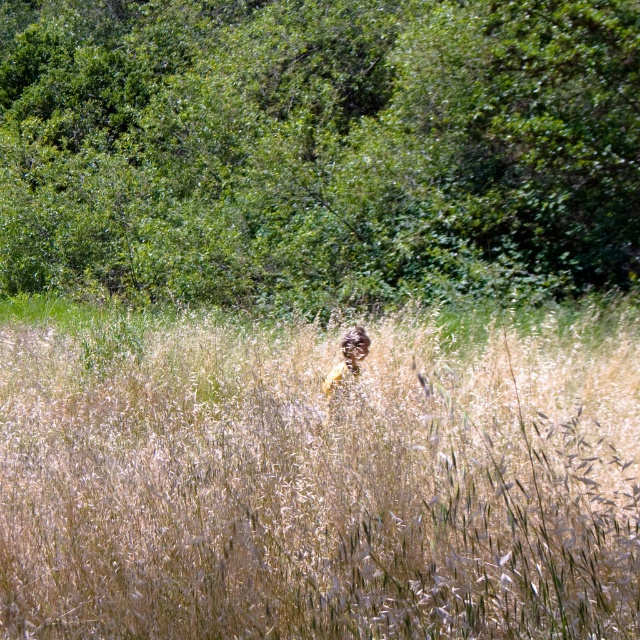
Question: Can you confirm if dry grass at center is bigger than green leafy tree at upper center?

Choices:
 (A) yes
 (B) no

Answer: (B)

Question: Does dry grass at center have a larger size compared to green leafy tree at upper center?

Choices:
 (A) no
 (B) yes

Answer: (A)

Question: Considering the real-world distances, which object is farthest from the dry grass at center?

Choices:
 (A) green leafy tree at upper center
 (B) brown textured jacket at center

Answer: (A)

Question: Where is dry grass at center located in relation to brown textured jacket at center in the image?

Choices:
 (A) right
 (B) left

Answer: (B)

Question: Estimate the real-world distances between objects in this image. Which object is closer to the green leafy tree at upper center?

Choices:
 (A) dry grass at center
 (B) brown textured jacket at center

Answer: (A)

Question: Which point is closer to the camera?

Choices:
 (A) (604, 156)
 (B) (349, 362)

Answer: (B)